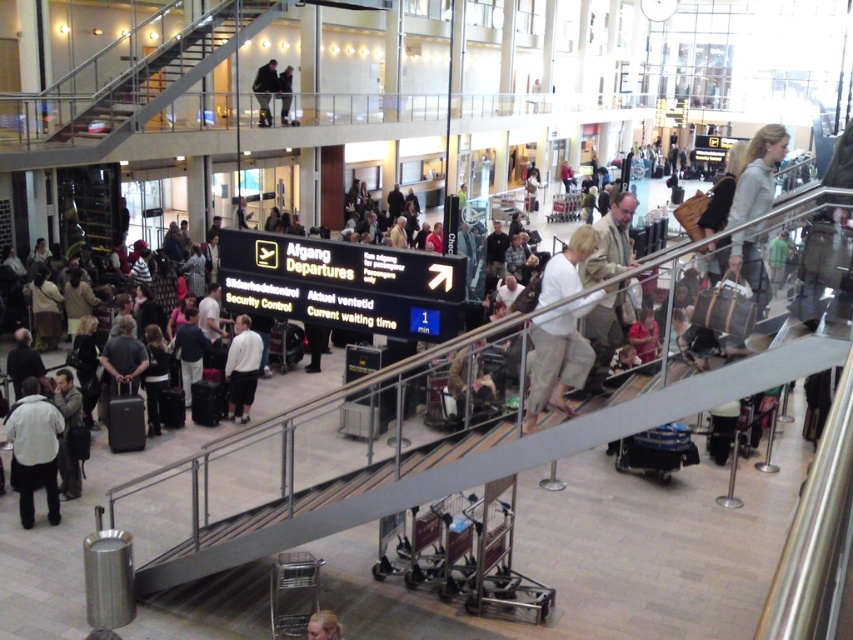
You are a passenger at the airport and need to reach the security control. You see a metallic staircase at upper left and a light beige fabric jacket at upper right. Which object should you go towards to locate the security control area?

You should go towards the metallic staircase at upper left because it is positioned to the left of the light beige fabric jacket at upper right, which is likely closer to the security control area indicated by the signboard.

From the picture: You are a passenger at the airport and need to reach the departure gates. You see a metallic staircase at upper left. Is the staircase located closer to the digital signboard or further away from it?

The metallic staircase at upper left is located at point [144,74]. Since the digital signboard is at the center of the scene, the staircase is positioned at the upper left corner, making it further away from the signboard compared to other elements in the center.